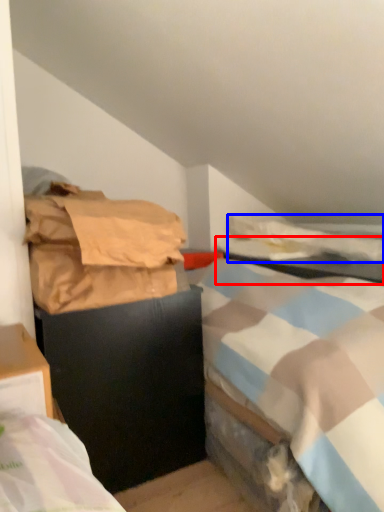
Question: Which point is further to the camera, table (highlighted by a red box) or blanket (highlighted by a blue box)?

Choices:
 (A) table
 (B) blanket

Answer: (B)